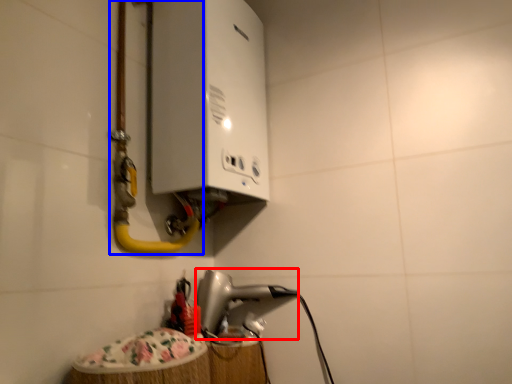
Question: Which object appears closest to the camera in this image, appliance (highlighted by a red box) or water pipe (highlighted by a blue box)?

Choices:
 (A) appliance
 (B) water pipe

Answer: (B)